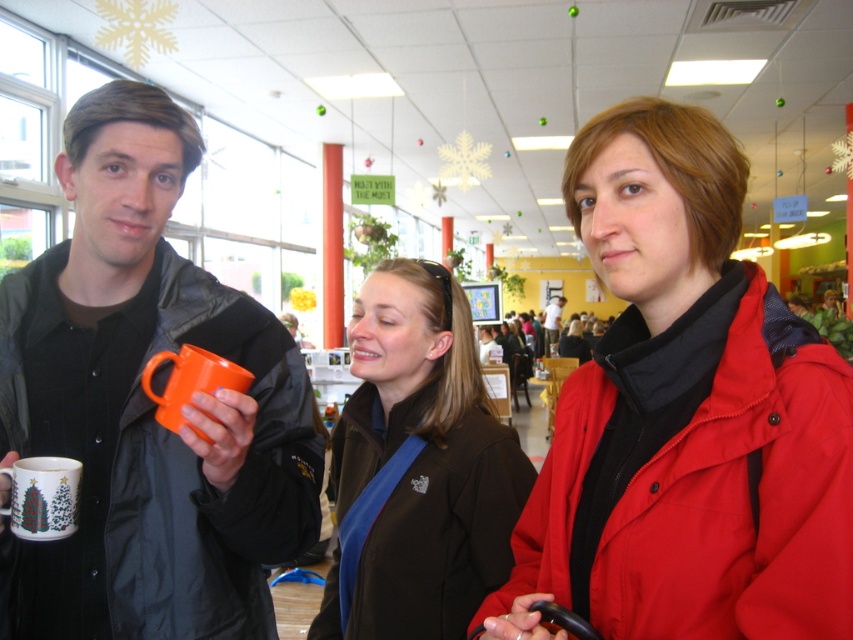
Consider the image. You are a photographer standing at the back of the room. You want to take a photo of both the matte orange mug at left and the orange matte mug at center. Can you fit both mugs in your camera frame if your camera has a minimum focus distance of 18 centimeters?

The distance between the matte orange mug at left and the orange matte mug at center is 17.82 centimeters. Since the camera requires a minimum focus distance of 18 centimeters, the photographer cannot fit both mugs within the frame as the current distance is slightly less than required.

You are standing in the festive indoor scene and want to place a small decoration. You have two points marked at coordinates point (158, 358) and point (555, 320). Which point is closer to you where you can place the decoration more easily?

Point (158, 358) is closer to the viewer than point (555, 320), so you can place the decoration more easily at point (158, 358).

You are at a holiday party and see two mugs on the table. The matte orange mug at left and the orange matte mug at center. Which one is positioned more to the right?

The orange matte mug at center is positioned more to the right than the matte orange mug at left.